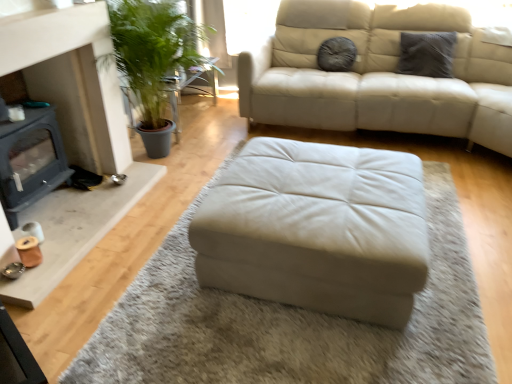
Question: Could you tell me if beige leather ottoman at center is turned towards gray textured pillow at upper right, acting as the first pillow starting from the right?

Choices:
 (A) no
 (B) yes

Answer: (A)

Question: Can you confirm if beige leather ottoman at center is wider than gray textured pillow at upper right, arranged as the 2th pillow when viewed from the left?

Choices:
 (A) yes
 (B) no

Answer: (A)

Question: Considering the relative sizes of beige leather ottoman at center and gray textured pillow at upper right, acting as the first pillow starting from the right, in the image provided, is beige leather ottoman at center bigger than gray textured pillow at upper right, acting as the first pillow starting from the right,?

Choices:
 (A) no
 (B) yes

Answer: (B)

Question: Is beige leather ottoman at center touching gray textured pillow at upper right, acting as the first pillow starting from the right?

Choices:
 (A) no
 (B) yes

Answer: (A)

Question: Is beige leather ottoman at center positioned with its back to gray textured pillow at upper right, acting as the first pillow starting from the right?

Choices:
 (A) no
 (B) yes

Answer: (A)

Question: Is beige leather ottoman at center taller than gray textured pillow at upper right, acting as the first pillow starting from the right?

Choices:
 (A) no
 (B) yes

Answer: (A)

Question: Does fuzzy gray pillow at upper center, which is counted as the second pillow, starting from the right, come behind matte gray fireplace at lower left?

Choices:
 (A) no
 (B) yes

Answer: (B)

Question: Does fuzzy gray pillow at upper center, which is the 1th pillow from left to right, come in front of matte gray fireplace at lower left?

Choices:
 (A) no
 (B) yes

Answer: (A)

Question: Considering the relative sizes of fuzzy gray pillow at upper center, which is the 1th pillow from left to right, and matte gray fireplace at lower left in the image provided, is fuzzy gray pillow at upper center, which is the 1th pillow from left to right, wider than matte gray fireplace at lower left?

Choices:
 (A) yes
 (B) no

Answer: (B)

Question: Is fuzzy gray pillow at upper center, which is counted as the second pillow, starting from the right, with matte gray fireplace at lower left?

Choices:
 (A) yes
 (B) no

Answer: (B)

Question: Is fuzzy gray pillow at upper center, which is the 1th pillow from left to right, oriented towards matte gray fireplace at lower left?

Choices:
 (A) yes
 (B) no

Answer: (B)

Question: Would you say fuzzy gray pillow at upper center, which is counted as the second pillow, starting from the right, contains matte gray fireplace at lower left?

Choices:
 (A) no
 (B) yes

Answer: (A)

Question: Does fuzzy gray pillow at upper center, which is the 1th pillow from left to right, have a lesser height compared to green leafy plant at left?

Choices:
 (A) yes
 (B) no

Answer: (A)